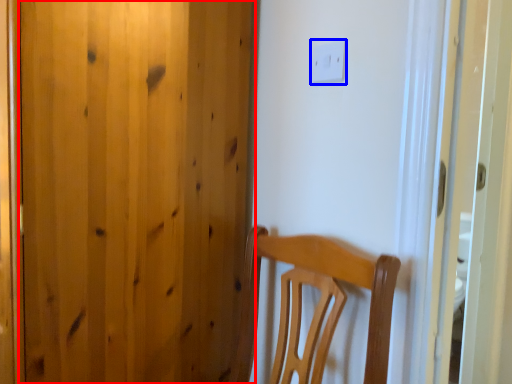
Question: Which of the following is the farthest to the observer, door (highlighted by a red box) or light switch (highlighted by a blue box)?

Choices:
 (A) door
 (B) light switch

Answer: (B)